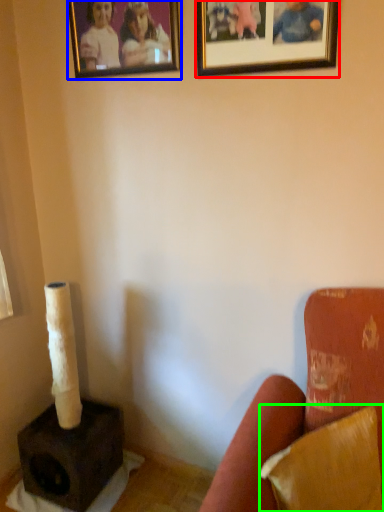
Question: Which is farther away from picture frame (highlighted by a red box)? picture frame (highlighted by a blue box) or pillow (highlighted by a green box)?

Choices:
 (A) picture frame
 (B) pillow

Answer: (B)